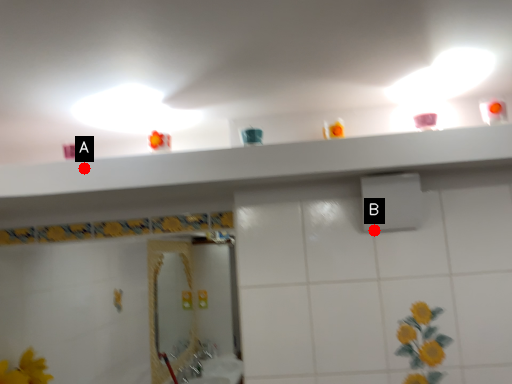
Question: Two points are circled on the image, labeled by A and B beside each circle. Which of the following is the closest to the observer?

Choices:
 (A) A is closer
 (B) B is closer

Answer: (A)